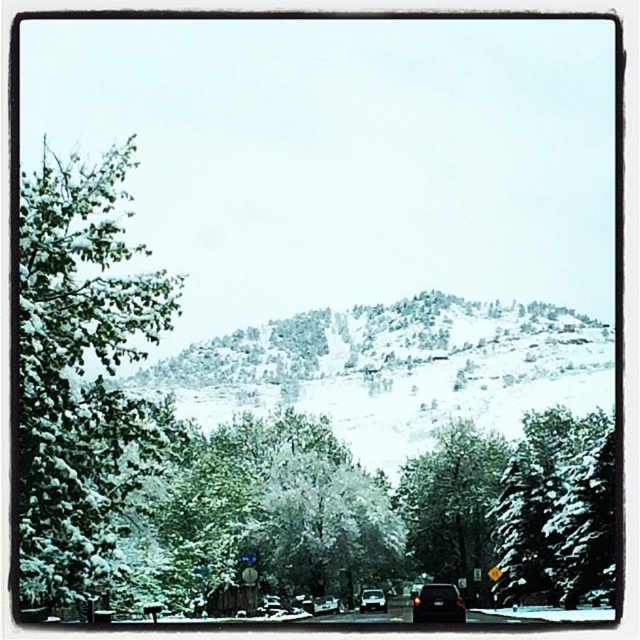
Does green leafy tree at left have a greater width compared to snow-covered tree at center?

Yes.

Which is more to the left, green leafy tree at left or snow-covered tree at center?

green leafy tree at left

Between point (19, 522) and point (490, 593), which one is positioned in front?

Point (19, 522)

Find the location of a particular element. green leafy tree at left is located at coordinates point(83,374).

Can you confirm if snow-covered evergreen at right is taller than black matte van at center?

Indeed, snow-covered evergreen at right has a greater height compared to black matte van at center.

Does snow-covered evergreen at right appear on the left side of black matte van at center?

No, snow-covered evergreen at right is not to the left of black matte van at center.

Which is in front, point (499, 561) or point (440, 588)?

Point (440, 588)

Locate an element on the screen. Image resolution: width=640 pixels, height=640 pixels. snow-covered evergreen at right is located at coordinates click(557, 512).

Is point (314, 605) behind point (385, 600)?

That is False.

The width and height of the screenshot is (640, 640). I want to click on shiny black car at center, so click(321, 605).